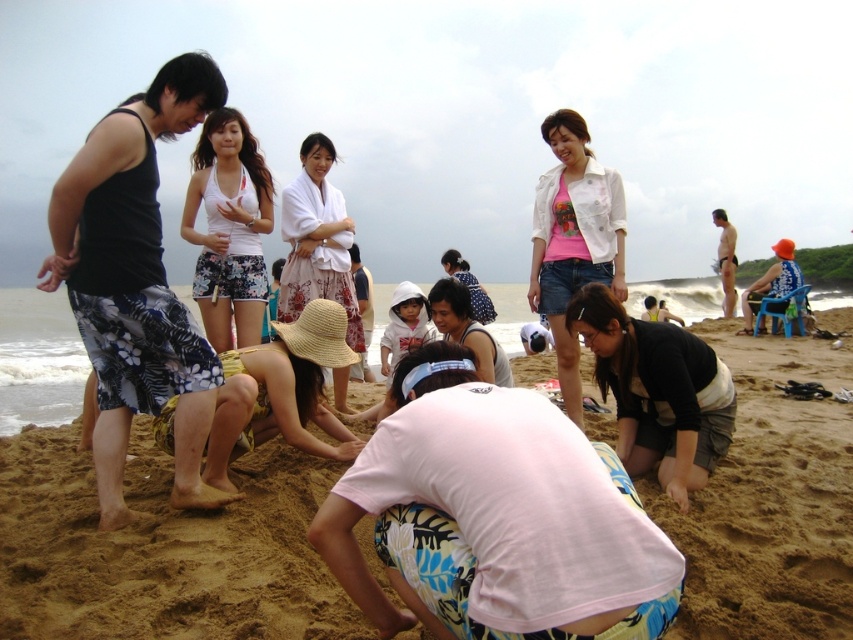
Is white cotton robe at center to the right of white cotton hat at center from the viewer's perspective?

Incorrect, white cotton robe at center is not on the right side of white cotton hat at center.

Is white cotton robe at center closer to the viewer compared to white cotton hat at center?

No, it is not.

Is point (318, 282) positioned in front of point (479, 352)?

No.

Find the location of `white cotton robe at center`. white cotton robe at center is located at coordinates (317, 241).

Can you confirm if black cotton shirt at lower center is positioned below white fabric shorts at center?

Correct, black cotton shirt at lower center is located below white fabric shorts at center.

Does black cotton shirt at lower center have a greater height compared to white fabric shorts at center?

In fact, black cotton shirt at lower center may be shorter than white fabric shorts at center.

Does point (642, 413) lie behind point (222, 282)?

No, it is not.

At what (x,y) coordinates should I click in order to perform the action: click on black cotton shirt at lower center. Please return your answer as a coordinate pair (x, y). The width and height of the screenshot is (853, 640). Looking at the image, I should click on (657, 392).

Can you confirm if white cotton hat at center is positioned to the left of white cotton hoodie at center?

Incorrect, white cotton hat at center is not on the left side of white cotton hoodie at center.

Is white cotton hat at center smaller than white cotton hoodie at center?

Yes, white cotton hat at center is smaller than white cotton hoodie at center.

Who is more forward, (444, 323) or (408, 284)?

Point (444, 323) is in front.

What are the coordinates of `white cotton hat at center` in the screenshot? It's located at (467, 330).